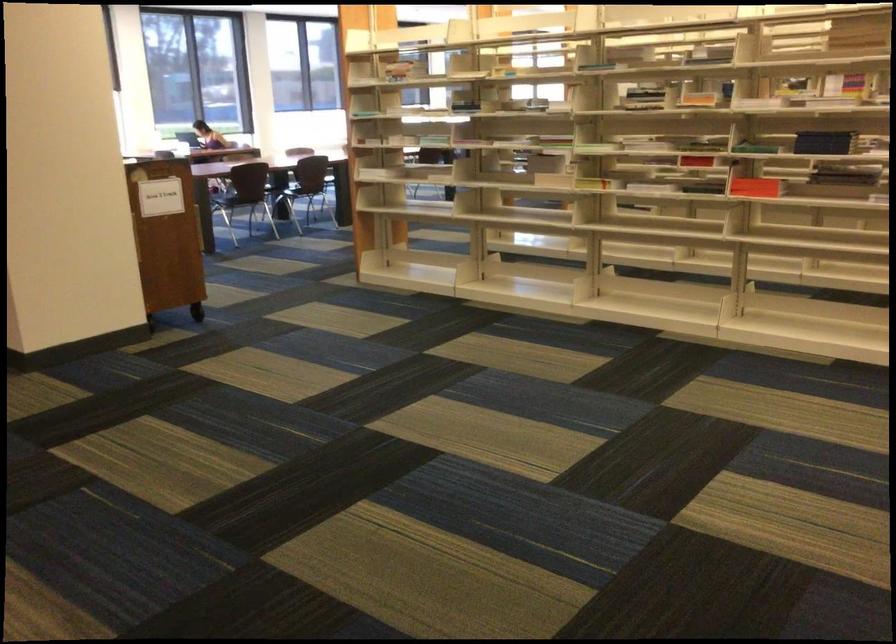
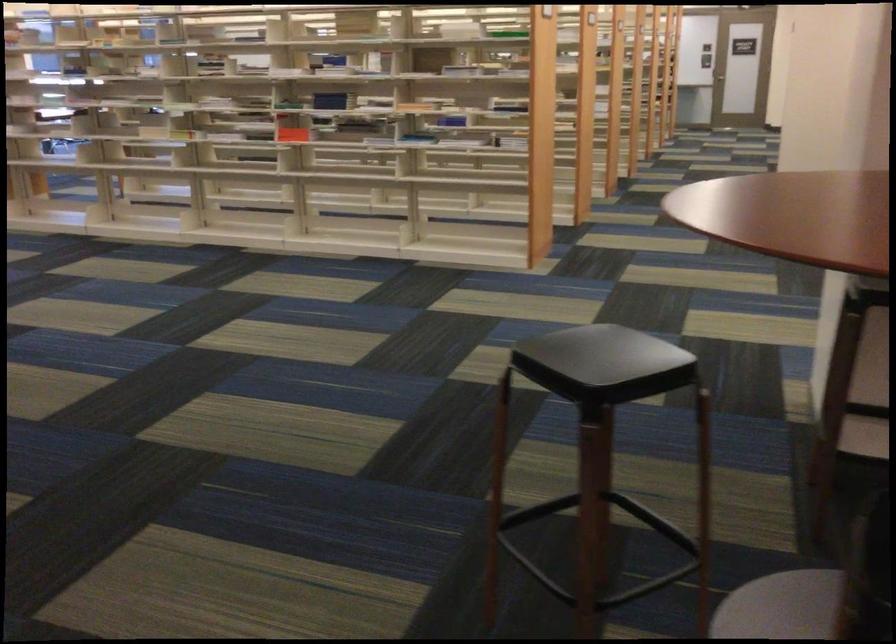
The point at (748, 200) is marked in the first image. Where is the corresponding point in the second image?

(291, 131)